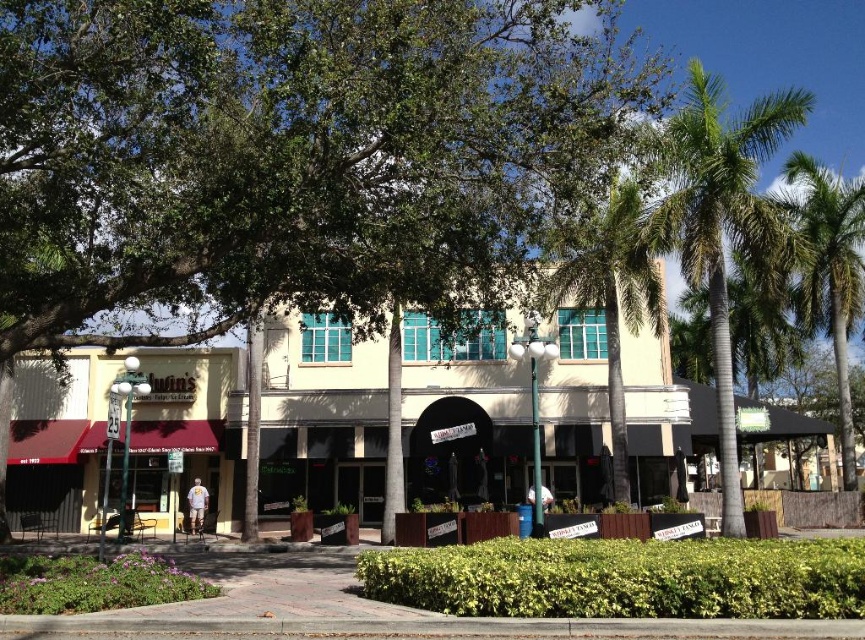
Does green leafy palm tree at upper right come behind green leafy palm tree at center?

Yes, it is behind green leafy palm tree at center.

Can you confirm if green leafy palm tree at upper right is positioned to the left of green leafy palm tree at center?

Incorrect, green leafy palm tree at upper right is not on the left side of green leafy palm tree at center.

Which is in front, point (753, 248) or point (636, 241)?

Point (753, 248) is more forward.

Where is `green leafy palm tree at upper right`? Image resolution: width=865 pixels, height=640 pixels. green leafy palm tree at upper right is located at coordinates (722, 224).

Can you confirm if green leafy tree at center is taller than beige concrete storefront at center?

Indeed, green leafy tree at center has a greater height compared to beige concrete storefront at center.

Between point (460, 289) and point (548, 410), which one is positioned behind?

The point (548, 410) is more distant.

This screenshot has height=640, width=865. Find the location of `green leafy tree at center`. green leafy tree at center is located at coordinates (x=292, y=157).

This screenshot has height=640, width=865. I want to click on green leafy tree at center, so click(x=292, y=157).

Which is more to the right, beige concrete storefront at center or green leafy palm tree at center?

From the viewer's perspective, green leafy palm tree at center appears more on the right side.

Measure the distance from beige concrete storefront at center to green leafy palm tree at center.

4.28 meters

Find the location of `beige concrete storefront at center`. beige concrete storefront at center is located at coordinates (322, 410).

Find the location of `beige concrete storefront at center`. beige concrete storefront at center is located at coordinates (322, 410).